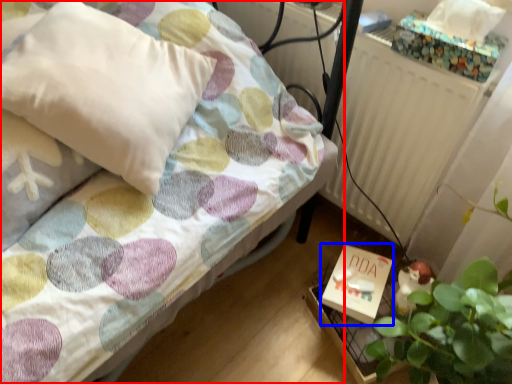
Question: Which object appears farthest to the camera in this image, bed (highlighted by a red box) or box (highlighted by a blue box)?

Choices:
 (A) bed
 (B) box

Answer: (B)